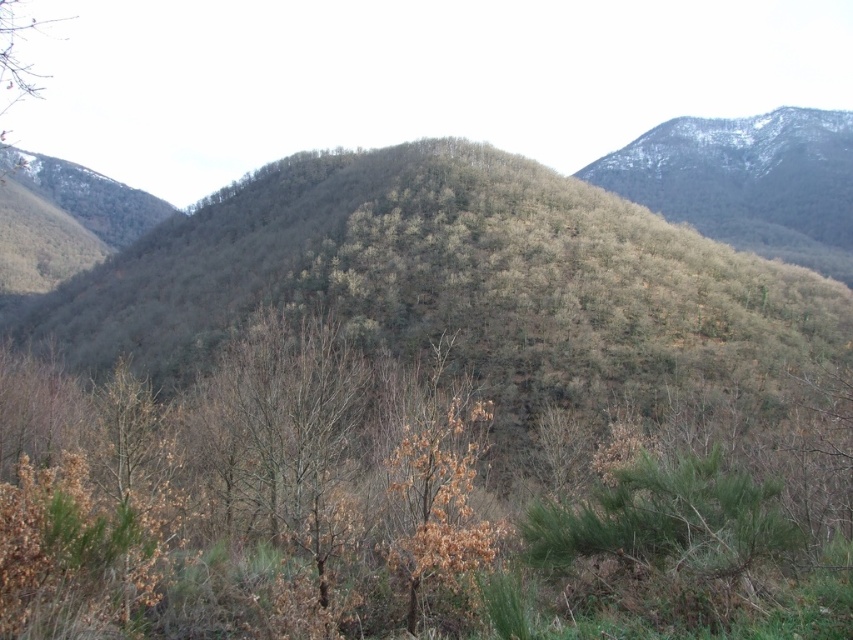
You are a hiker standing at the bottom of the mountain looking up. You notice a brown leafy tree at center. Where is this tree located in your field of view?

The brown leafy tree at center is located at the center of your field of view, specifically at the coordinates point (247, 497).

You are an environmental researcher studying tree distribution in this mountainous area. You observe the brown leafy tree at center and the brown leafless tree at upper left. Which tree is positioned to the east of the other?

The brown leafy tree at center is to the east of the brown leafless tree at upper left because it is positioned to the right of it in the image, and the scene is oriented with east to the right.